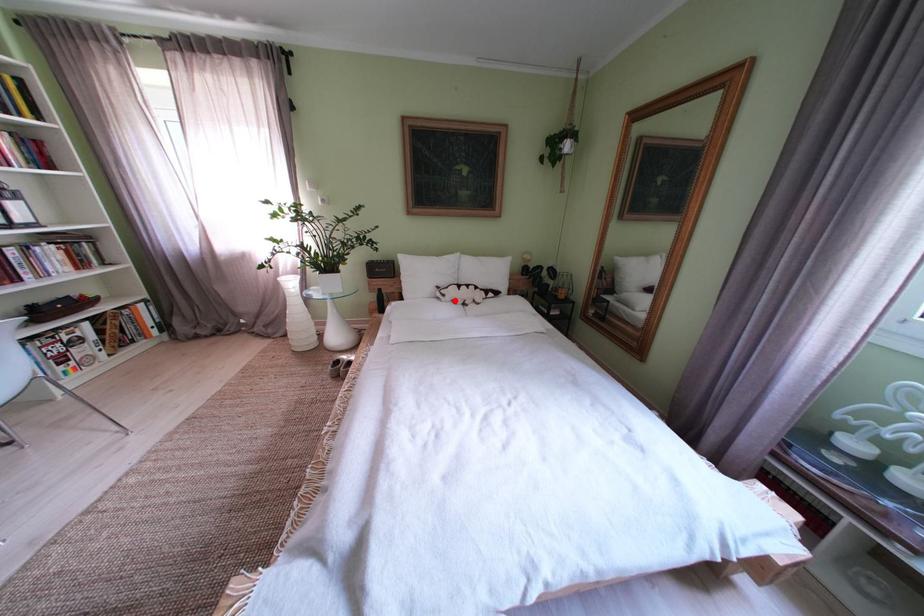
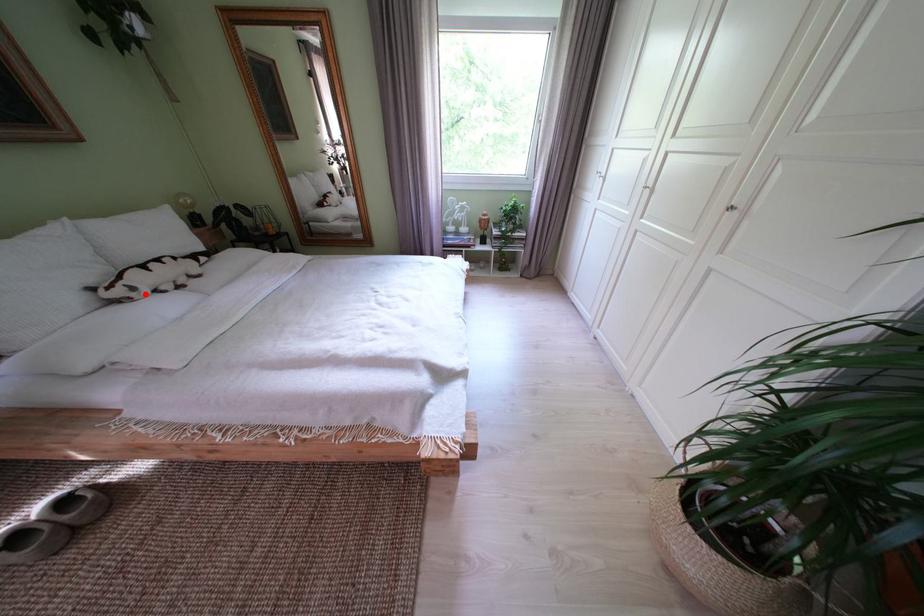
I am providing you with two images of the same scene from different viewpoints. A red point is marked on the first image and another point is marked on the second image. Does the point marked in image1 correspond to the same location as the one in image2?

Yes